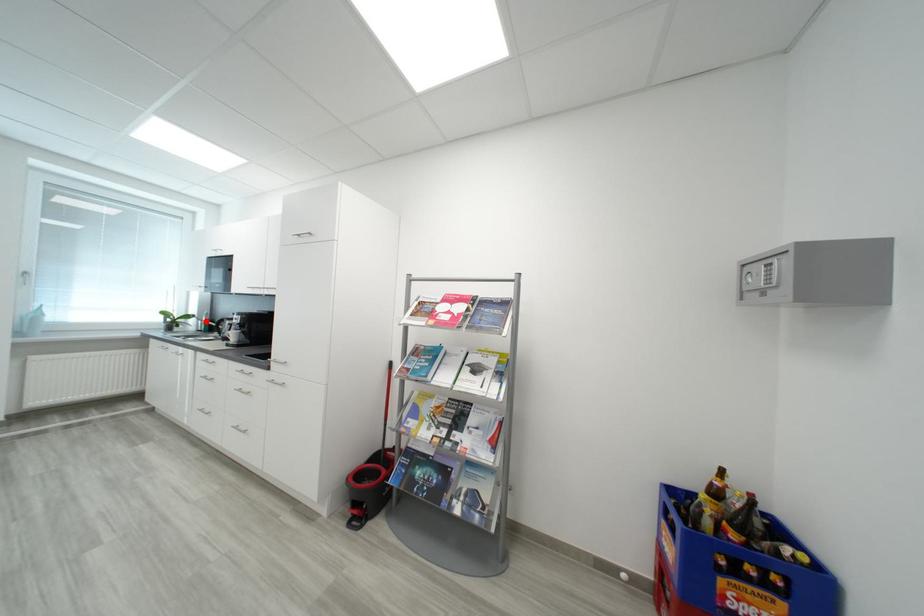
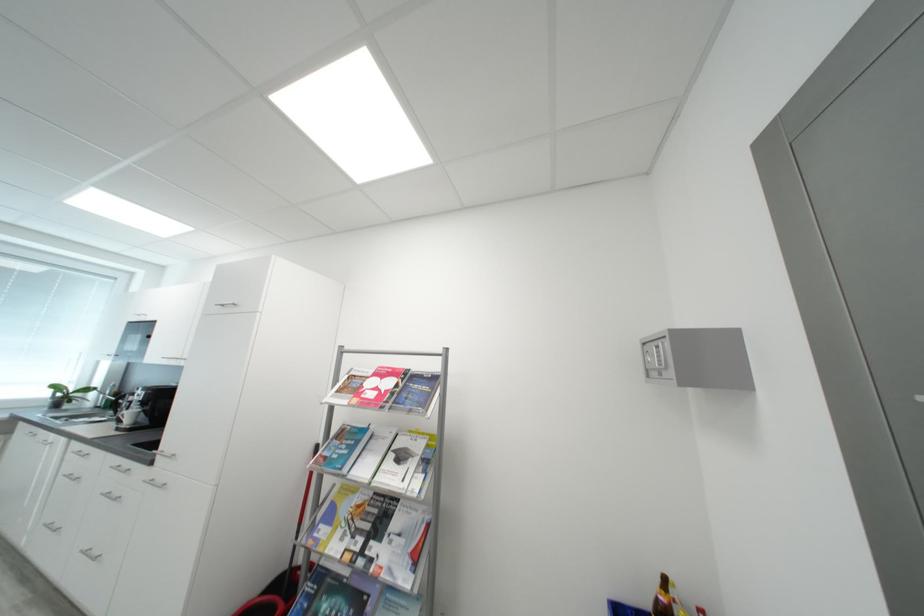
The point at the highlighted location is marked in the first image. Where is the corresponding point in the second image?

(108, 394)